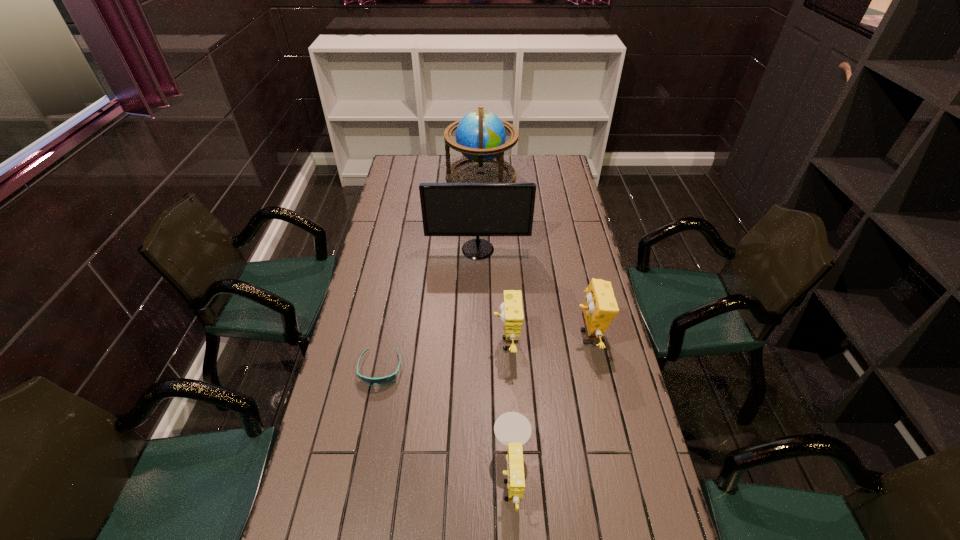
Choose which sponge is the nearest neighbor to the fifth shortest object. Please provide its 2D coordinates. Your answer should be formatted as a tuple, i.e. [(x, y)], where the tuple contains the x and y coordinates of a point satisfying the conditions above.

[(600, 307)]

The height and width of the screenshot is (540, 960). Identify the location of vacant space that satisfies the following two spatial constraints: 1. on the face of the rightmost object; 2. on the front-facing side of the sunglasses. (595, 369).

Locate an element on the screen. The image size is (960, 540). vacant space that satisfies the following two spatial constraints: 1. on the face of the rightmost object; 2. on the front-facing side of the leftmost object is located at coordinates (595, 369).